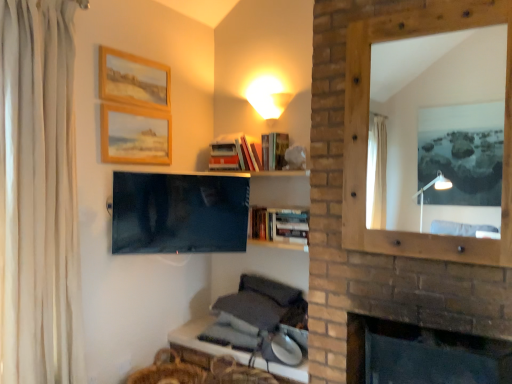
The height and width of the screenshot is (384, 512). In order to click on blank space situated above wooden mirror at right (from a real-world perspective) in this screenshot , I will do `click(395, 14)`.